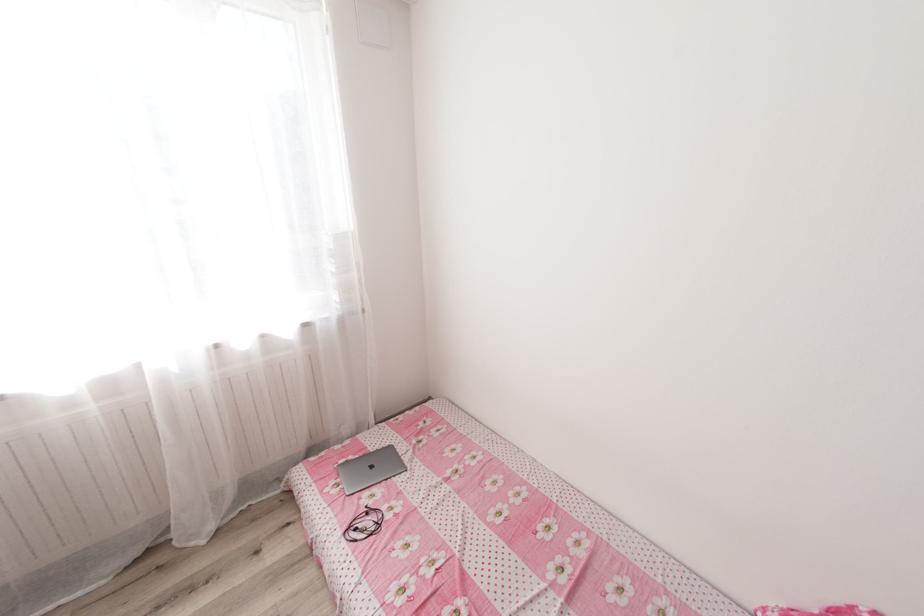
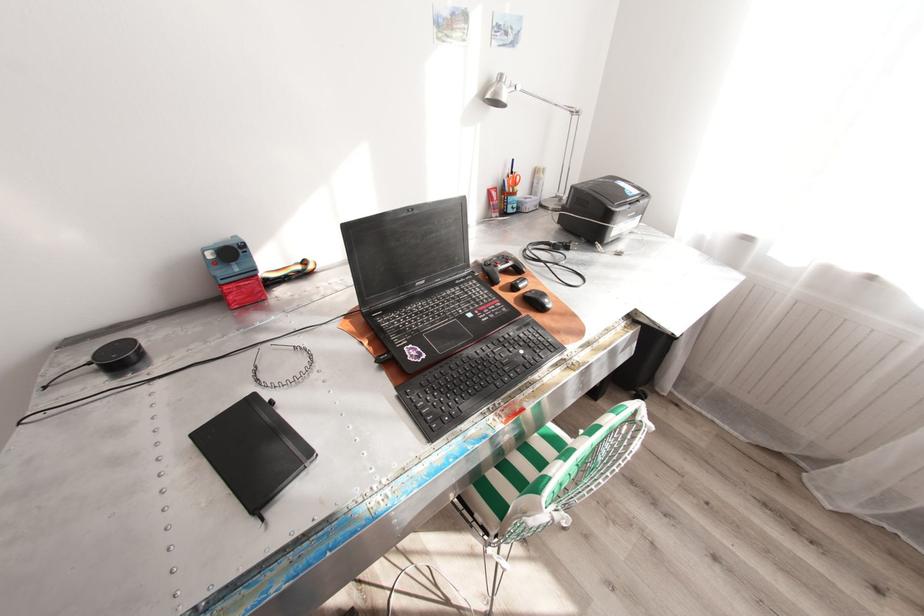
The first image is from the beginning of the video and the second image is from the end. How did the camera likely rotate when shooting the video?

The camera's rotation is toward left-down.